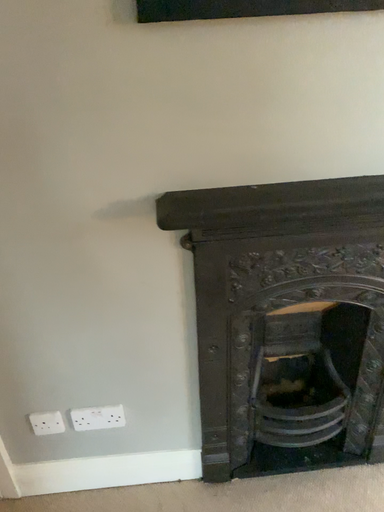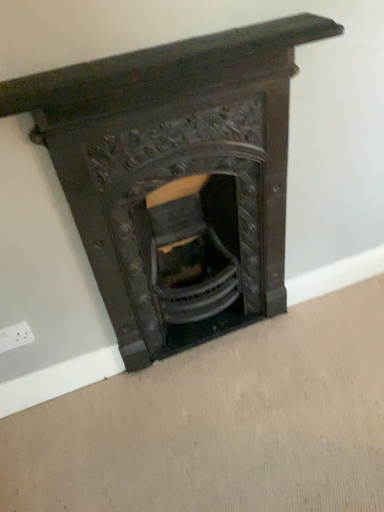
Question: Which way did the camera rotate in the video?

Choices:
 (A) rotated upward
 (B) rotated downward

Answer: (B)